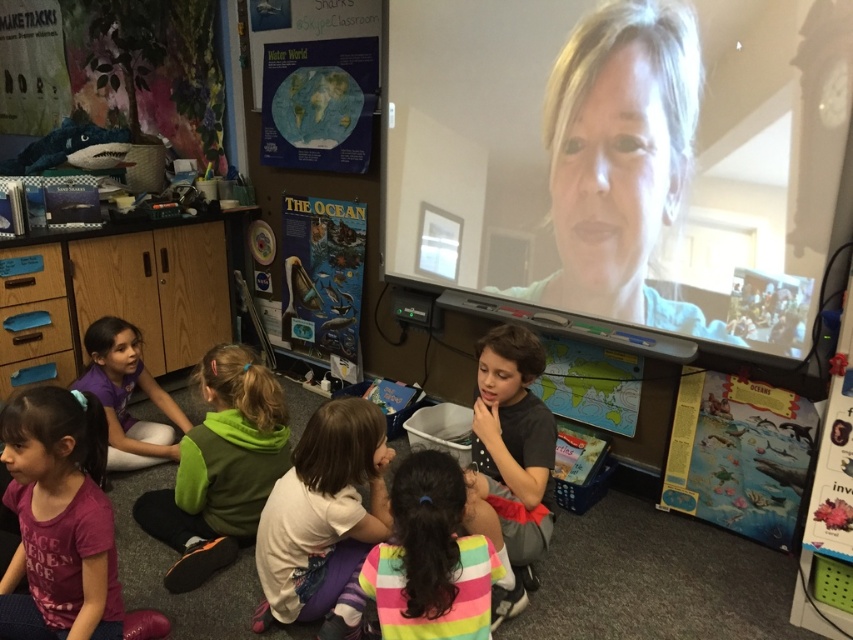
Does point (282, 554) come behind point (474, 600)?

Yes, point (282, 554) is behind point (474, 600).

Describe the element at coordinates (322, 513) in the screenshot. I see `white soft shirt at center` at that location.

Where is `white soft shirt at center`? The image size is (853, 640). white soft shirt at center is located at coordinates (322, 513).

Find the location of a particular element. blonde hair at upper center is located at coordinates (619, 161).

In the scene shown: How much distance is there between blonde hair at upper center and multicolored striped shirt at center?

blonde hair at upper center is 4.35 feet away from multicolored striped shirt at center.

Identify the location of blonde hair at upper center. (619, 161).

Which of these two, purple cotton shirt at lower left or white soft shirt at center, stands shorter?

white soft shirt at center is shorter.

Is point (108, 605) closer to viewer compared to point (318, 554)?

Yes, it is in front of point (318, 554).

Locate an element on the screen. The image size is (853, 640). purple cotton shirt at lower left is located at coordinates 59,518.

This screenshot has height=640, width=853. Identify the location of purple cotton shirt at lower left. (59, 518).